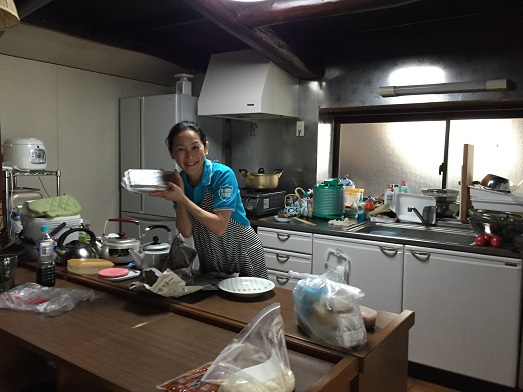
You are a GUI agent. You are given a task and a screenshot of the screen. Output one action in this format:
    pyautogui.click(x=<x>, y=<y>)
    Task: Click on the wall
    The width and height of the screenshot is (523, 392).
    Given the screenshot: What is the action you would take?
    pyautogui.click(x=104, y=165)